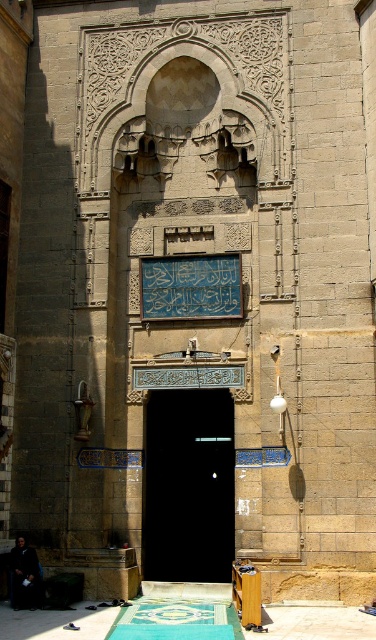
Question: Can you confirm if green woven mat at lower center is wider than dark brown leather jacket at lower left?

Choices:
 (A) yes
 (B) no

Answer: (A)

Question: Based on their relative distances, which object is farther from the dark brown leather jacket at lower left?

Choices:
 (A) black glass door at center
 (B) green woven mat at lower center

Answer: (A)

Question: Can you confirm if black glass door at center is positioned to the left of dark brown leather jacket at lower left?

Choices:
 (A) no
 (B) yes

Answer: (A)

Question: Is black glass door at center in front of dark brown leather jacket at lower left?

Choices:
 (A) yes
 (B) no

Answer: (B)

Question: Which point is farther to the camera?

Choices:
 (A) green woven mat at lower center
 (B) dark brown leather jacket at lower left
 (C) black glass door at center

Answer: (C)

Question: Which of the following is the closest to the observer?

Choices:
 (A) (212, 525)
 (B) (30, 595)

Answer: (B)